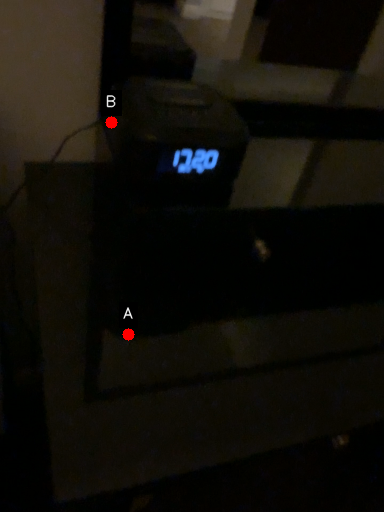
Question: Two points are circled on the image, labeled by A and B beside each circle. Which of the following is the farthest from the observer?

Choices:
 (A) A is further
 (B) B is further

Answer: (A)